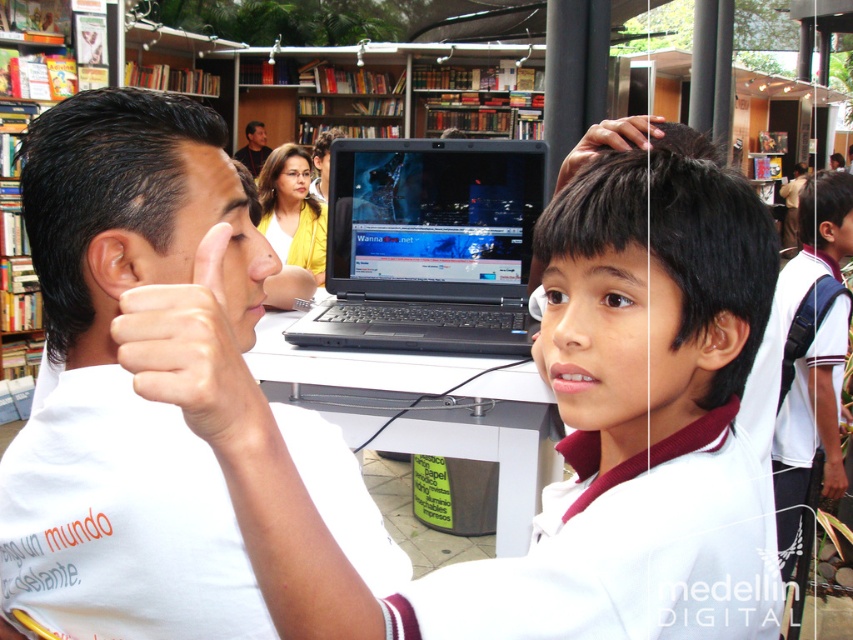
Is black plastic laptop at center below matte black laptop at upper center?

Correct, black plastic laptop at center is located below matte black laptop at upper center.

Between black plastic laptop at center and matte black laptop at upper center, which one appears on the right side from the viewer's perspective?

Positioned to the right is black plastic laptop at center.

The image size is (853, 640). Identify the location of black plastic laptop at center. (428, 246).

This screenshot has height=640, width=853. In order to click on black plastic laptop at center in this screenshot , I will do `click(428, 246)`.

Does dark brown hair at upper center have a smaller size compared to matte black laptop at upper center?

Yes, dark brown hair at upper center is smaller than matte black laptop at upper center.

Where is `dark brown hair at upper center`? The height and width of the screenshot is (640, 853). dark brown hair at upper center is located at coordinates (608, 141).

Can you confirm if black plastic laptop at center is wider than skinny flesh-toned hand at center?

→ Yes.

From the picture: Is black plastic laptop at center to the left of skinny flesh-toned hand at center from the viewer's perspective?

In fact, black plastic laptop at center is to the right of skinny flesh-toned hand at center.

At what (x,y) coordinates should I click in order to perform the action: click on black plastic laptop at center. Please return your answer as a coordinate pair (x, y). Looking at the image, I should click on tap(428, 246).